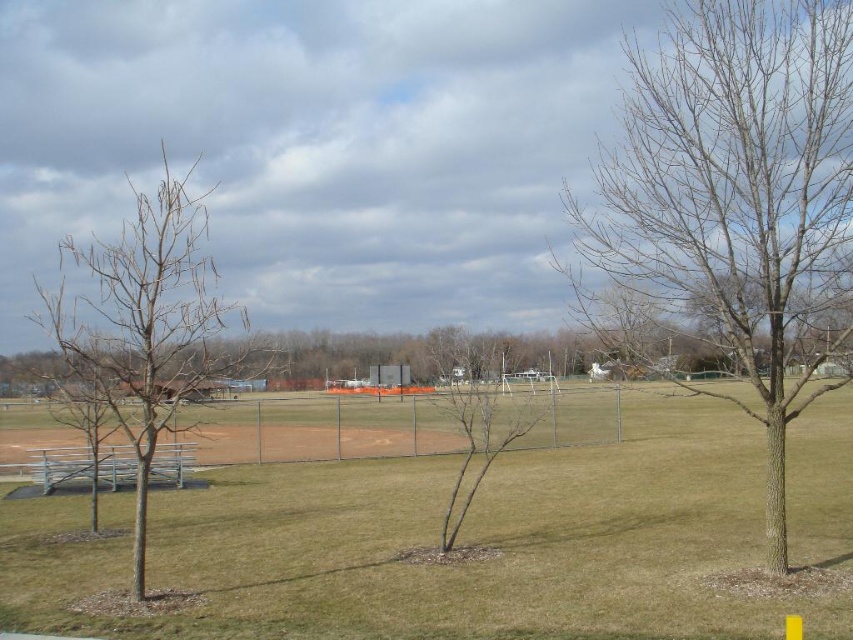
You are a groundskeeper trying to determine which area needs more attention between the green grass at center and the bare wood tree at center. Based on their sizes, which one should you prioritize?

The green grass at center is larger in size than the bare wood tree at center, so you should prioritize the green grass at center since it requires more maintenance due to its larger area.

You are standing in the park and want to walk from the point at coordinates (817, 122) to the point at coordinates (512, 422). Which direction should you head to move away from the fenced baseball field?

Point (817, 122) is closer to the viewer than point (512, 422). To move away from the fenced baseball field, you should head towards the point at (512, 422), which is further away from your current position.